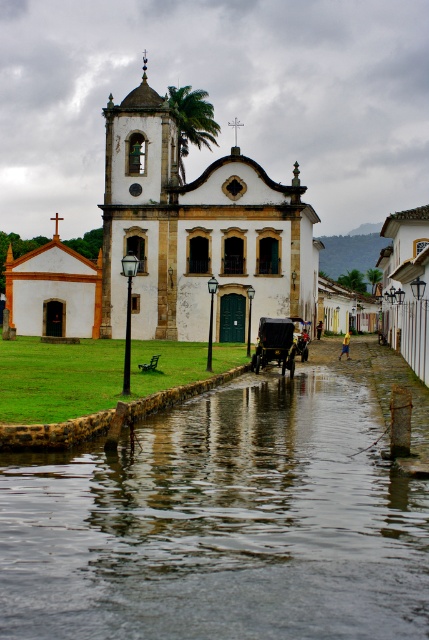
Can you confirm if green leafy palm tree at upper center is smaller than green leafy palm tree at center?

No.

Is point (183, 148) positioned after point (378, 272)?

That is False.

Is point (184, 106) farther from viewer compared to point (374, 289)?

That is False.

At what (x,y) coordinates should I click in order to perform the action: click on green leafy palm tree at upper center. Please return your answer as a coordinate pair (x, y). Looking at the image, I should click on (192, 122).

Is shiny black cart at center in front of green leafy palm tree at center?

Yes, shiny black cart at center is in front of green leafy palm tree at center.

Between shiny black cart at center and green leafy palm tree at center, which one has less height?

With less height is green leafy palm tree at center.

Is point (271, 353) farther from camera compared to point (368, 282)?

That is False.

At what (x,y) coordinates should I click in order to perform the action: click on shiny black cart at center. Please return your answer as a coordinate pair (x, y). This screenshot has height=640, width=429. Looking at the image, I should click on (274, 342).

From the picture: Which is more to the right, white stucco church at center or green leafy palm tree at center?

green leafy palm tree at center

Consider the image. Who is higher up, white stucco church at center or green leafy palm tree at center?

white stucco church at center is above.

Is point (253, 225) closer to viewer compared to point (377, 280)?

Yes, point (253, 225) is closer to viewer.

At what (x,y) coordinates should I click in order to perform the action: click on white stucco church at center. Please return your answer as a coordinate pair (x, y). The height and width of the screenshot is (640, 429). Looking at the image, I should click on (189, 236).